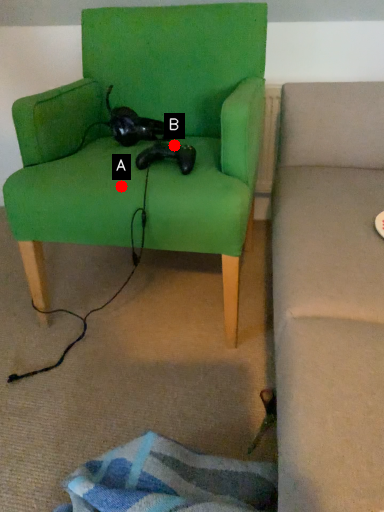
Question: Two points are circled on the image, labeled by A and B beside each circle. Which point is closer to the camera?

Choices:
 (A) A is closer
 (B) B is closer

Answer: (A)